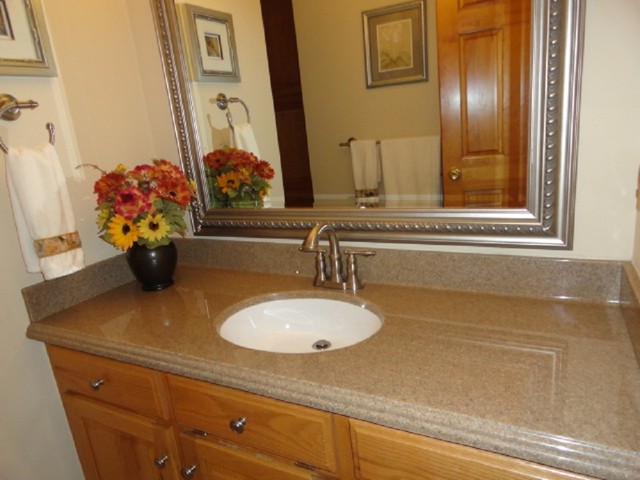
Find the location of a particular element. pot is located at coordinates pos(153,273).